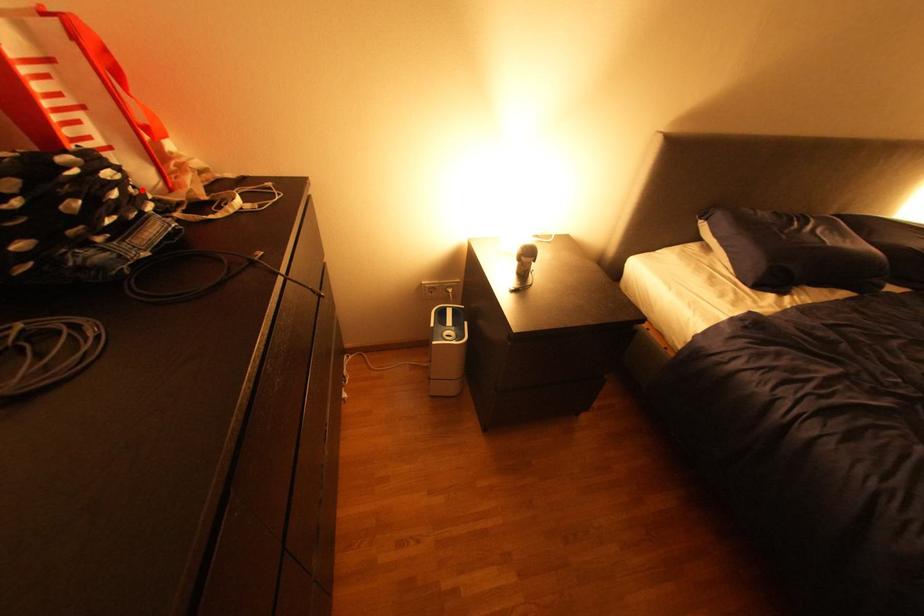
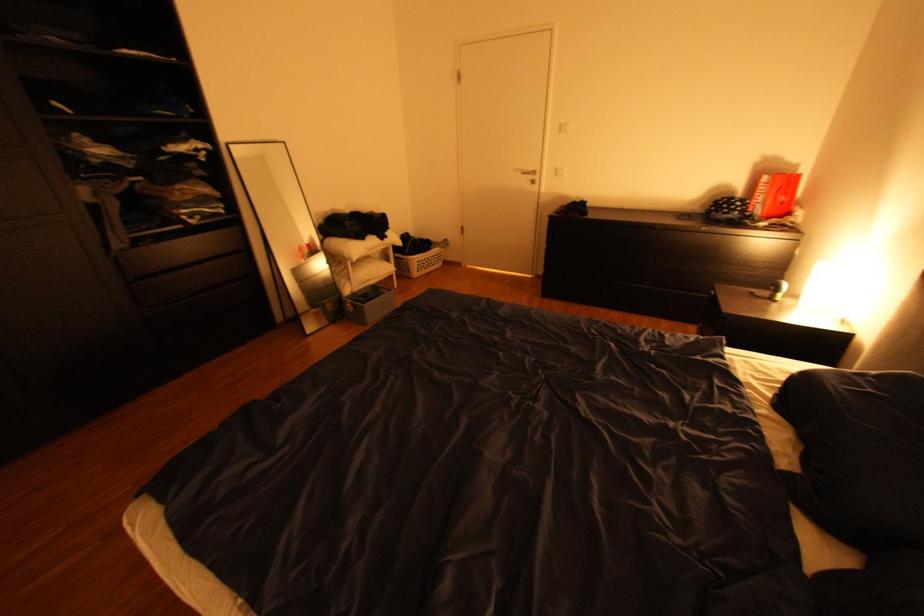
In the second image, find the point that corresponds to the highlighted location in the first image.

(748, 208)